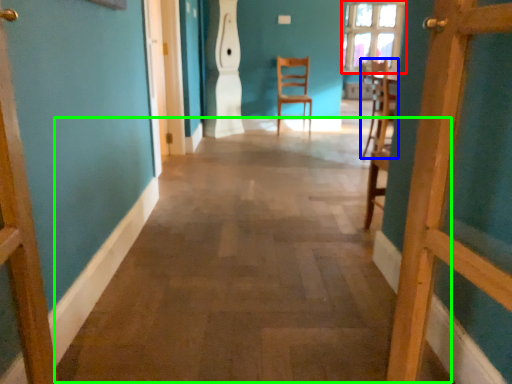
Question: Which object is the closest to the window (highlighted by a red box)? Choose among these: chair (highlighted by a blue box) or alley (highlighted by a green box).

Choices:
 (A) chair
 (B) alley

Answer: (A)